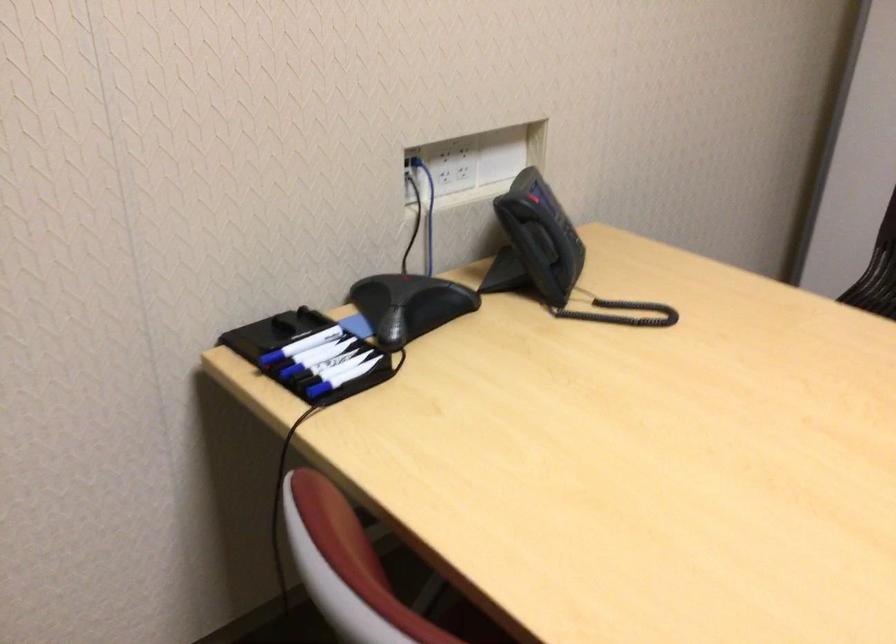
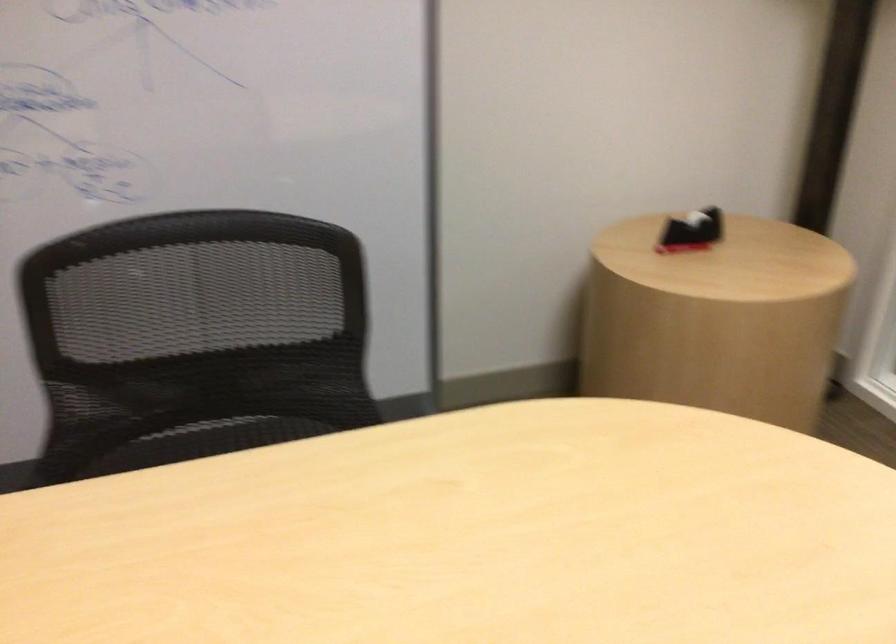
Question: The camera is either moving clockwise (left) or counter-clockwise (right) around the object. The first image is from the beginning of the video and the second image is from the end. Is the camera moving left or right when shooting the video?

Choices:
 (A) Left
 (B) Right

Answer: (A)